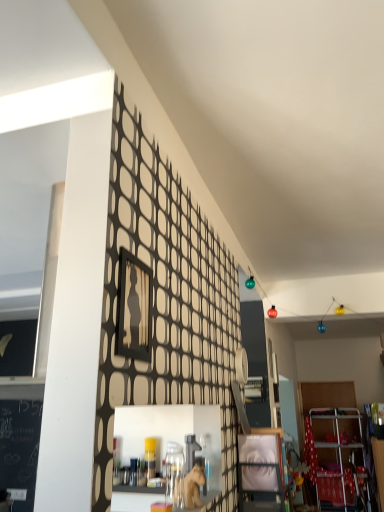
The image size is (384, 512). What do you see at coordinates (260, 473) in the screenshot? I see `matte wooden frame at center` at bounding box center [260, 473].

What are the coordinates of `matte wooden frame at center` in the screenshot? It's located at (260, 473).

Find the location of a particular element. wooden picture frame at center is located at coordinates (134, 308).

This screenshot has width=384, height=512. Describe the element at coordinates (134, 308) in the screenshot. I see `wooden picture frame at center` at that location.

Locate an element on the screen. This screenshot has height=512, width=384. matte wooden frame at center is located at coordinates (260, 473).

Between wooden picture frame at center and matte wooden frame at center, which one appears on the right side from the viewer's perspective?

Positioned to the right is matte wooden frame at center.

Is wooden picture frame at center behind matte wooden frame at center?

No, wooden picture frame at center is closer to the viewer.

Is point (136, 357) in front of point (273, 489)?

Yes, point (136, 357) is in front of point (273, 489).

From the image's perspective, who appears lower, wooden picture frame at center or matte wooden frame at center?

matte wooden frame at center appears lower in the image.

From a real-world perspective, which is physically above, wooden picture frame at center or matte wooden frame at center?

wooden picture frame at center.

Does wooden picture frame at center have a greater width compared to matte wooden frame at center?

In fact, wooden picture frame at center might be narrower than matte wooden frame at center.

From their relative heights in the image, would you say wooden picture frame at center is taller or shorter than matte wooden frame at center?

Clearly, wooden picture frame at center is taller compared to matte wooden frame at center.

Based on the photo, is wooden picture frame at center bigger than matte wooden frame at center?

No, wooden picture frame at center is not bigger than matte wooden frame at center.

Is wooden picture frame at center spatially inside matte wooden frame at center, or outside of it?

wooden picture frame at center is outside matte wooden frame at center.

Is wooden picture frame at center touching matte wooden frame at center?

Answer: wooden picture frame at center and matte wooden frame at center are not in contact.

Could you tell me if wooden picture frame at center is turned towards matte wooden frame at center?

No, wooden picture frame at center is not facing towards matte wooden frame at center.

How far apart are wooden picture frame at center and matte wooden frame at center?

wooden picture frame at center is 1.25 meters away from matte wooden frame at center.

Locate an element on the screen. This screenshot has width=384, height=512. shelf below the wooden picture frame at center (from the image's perspective) is located at coordinates (260, 473).

Which is more to the left, matte wooden frame at center or wooden picture frame at center?

Positioned to the left is wooden picture frame at center.

Is matte wooden frame at center positioned before wooden picture frame at center?

No, matte wooden frame at center is further to the viewer.

Which is closer to the camera, (x=268, y=510) or (x=134, y=288)?

Positioned in front is point (x=134, y=288).

From the image's perspective, is matte wooden frame at center positioned above or below wooden picture frame at center?

Clearly, from the image's perspective, matte wooden frame at center is below wooden picture frame at center.

From the picture: From a real-world perspective, which is physically below, matte wooden frame at center or wooden picture frame at center?

matte wooden frame at center, from a real-world perspective.

Looking at their sizes, would you say matte wooden frame at center is wider or thinner than wooden picture frame at center?

matte wooden frame at center is wider than wooden picture frame at center.

Considering the sizes of objects matte wooden frame at center and wooden picture frame at center in the image provided, who is taller, matte wooden frame at center or wooden picture frame at center?

With more height is wooden picture frame at center.

Which of these two, matte wooden frame at center or wooden picture frame at center, is smaller?

With smaller size is wooden picture frame at center.

Do you think matte wooden frame at center is within wooden picture frame at center, or outside of it?

matte wooden frame at center is not inside wooden picture frame at center, it's outside.

Is matte wooden frame at center positioned far away from wooden picture frame at center?

Yes, matte wooden frame at center and wooden picture frame at center are quite far apart.

Looking at this image, could you tell me if matte wooden frame at center is facing wooden picture frame at center?

No, matte wooden frame at center is not aimed at wooden picture frame at center.

What's the angular difference between matte wooden frame at center and wooden picture frame at center's facing directions?

The angle between the facing direction of matte wooden frame at center and the facing direction of wooden picture frame at center is 0.981 degrees.

Locate an element on the screen. shelf below the wooden picture frame at center (from the image's perspective) is located at coordinates click(x=260, y=473).

Identify the location of picture frame that is on the left side of matte wooden frame at center. This screenshot has width=384, height=512. (134, 308).

Find the location of `picture frame above the matte wooden frame at center (from the image's perspective)`. picture frame above the matte wooden frame at center (from the image's perspective) is located at coordinates (134, 308).